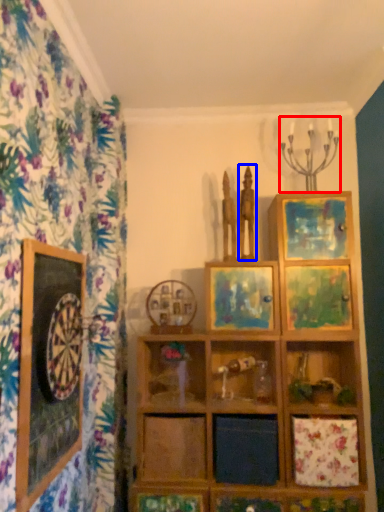
Question: Among these objects, which one is nearest to the camera, candle holder (highlighted by a red box) or sculpture (highlighted by a blue box)?

Choices:
 (A) candle holder
 (B) sculpture

Answer: (A)